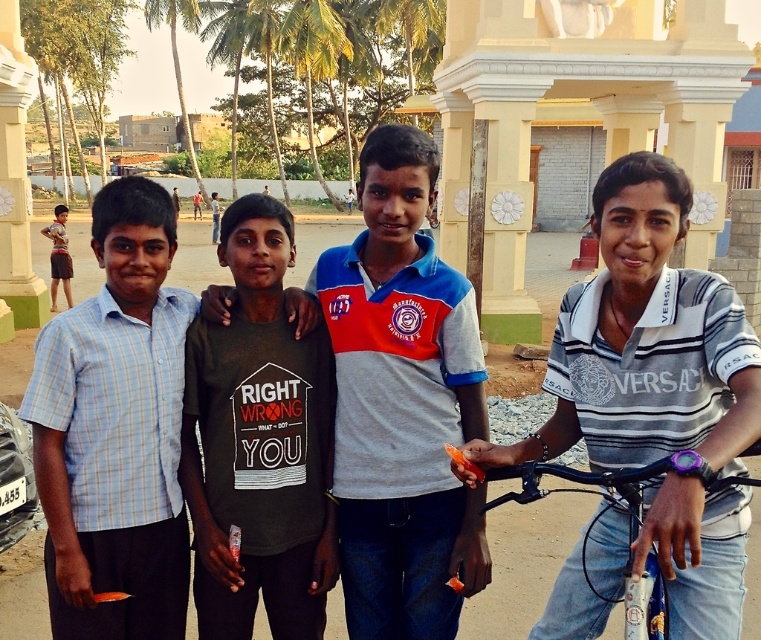
Question: Does gray cotton shirt at center have a greater width compared to light blue plaid shirt at left?

Choices:
 (A) no
 (B) yes

Answer: (A)

Question: Does gray striped polo shirt at right have a greater width compared to light blue plaid shirt at left?

Choices:
 (A) yes
 (B) no

Answer: (A)

Question: Based on their relative distances, which object is nearer to the gray cotton shirt at center?

Choices:
 (A) metallic blue bicycle at lower right
 (B) light blue plaid shirt at left
 (C) gray striped polo shirt at right
 (D) black matte shirt at center

Answer: (D)

Question: Which of the following is the farthest from the observer?

Choices:
 (A) (387, 488)
 (B) (750, 452)
 (C) (685, 486)
 (D) (88, 532)

Answer: (A)

Question: From the image, what is the correct spatial relationship of gray striped polo shirt at right in relation to light blue plaid shirt at left?

Choices:
 (A) left
 (B) right

Answer: (B)

Question: Among these points, which one is nearest to the camera?

Choices:
 (A) (250, 214)
 (B) (56, 412)
 (C) (715, 432)

Answer: (C)